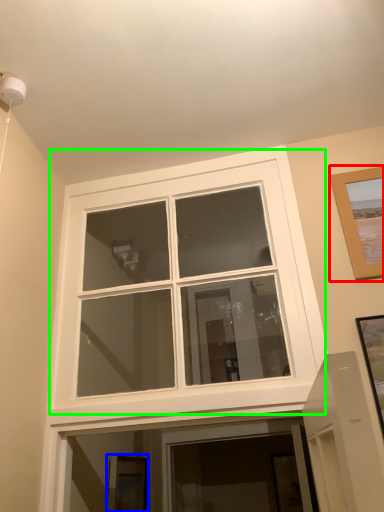
Question: Which is nearer to the picture frame (highlighted by a red box)? picture frame (highlighted by a blue box) or window (highlighted by a green box).

Choices:
 (A) picture frame
 (B) window

Answer: (B)